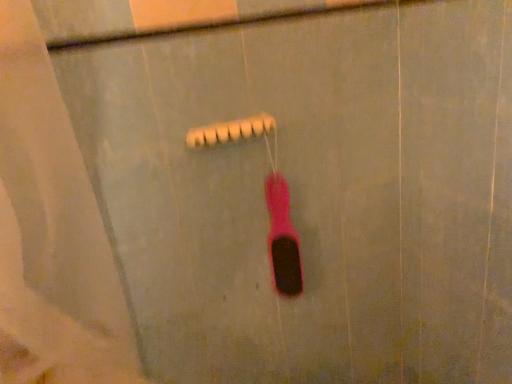
Question: Looking at the image, does pink rubber toothbrush at center seem bigger or smaller compared to beige matte shower head at center?

Choices:
 (A) small
 (B) big

Answer: (B)

Question: Considering the positions of pink rubber toothbrush at center and beige matte shower head at center in the image, is pink rubber toothbrush at center taller or shorter than beige matte shower head at center?

Choices:
 (A) short
 (B) tall

Answer: (B)

Question: Considering the relative positions of pink rubber toothbrush at center and beige matte shower head at center in the image provided, is pink rubber toothbrush at center to the left or to the right of beige matte shower head at center?

Choices:
 (A) right
 (B) left

Answer: (A)

Question: Is point (227, 130) closer or farther from the camera than point (278, 244)?

Choices:
 (A) farther
 (B) closer

Answer: (B)

Question: Considering their positions, is beige matte shower head at center located in front of or behind pink rubber toothbrush at center?

Choices:
 (A) behind
 (B) front

Answer: (B)

Question: Is beige matte shower head at center to the left or to the right of pink rubber toothbrush at center in the image?

Choices:
 (A) right
 (B) left

Answer: (B)

Question: Choose the correct answer: Is beige matte shower head at center inside pink rubber toothbrush at center or outside it?

Choices:
 (A) outside
 (B) inside

Answer: (A)